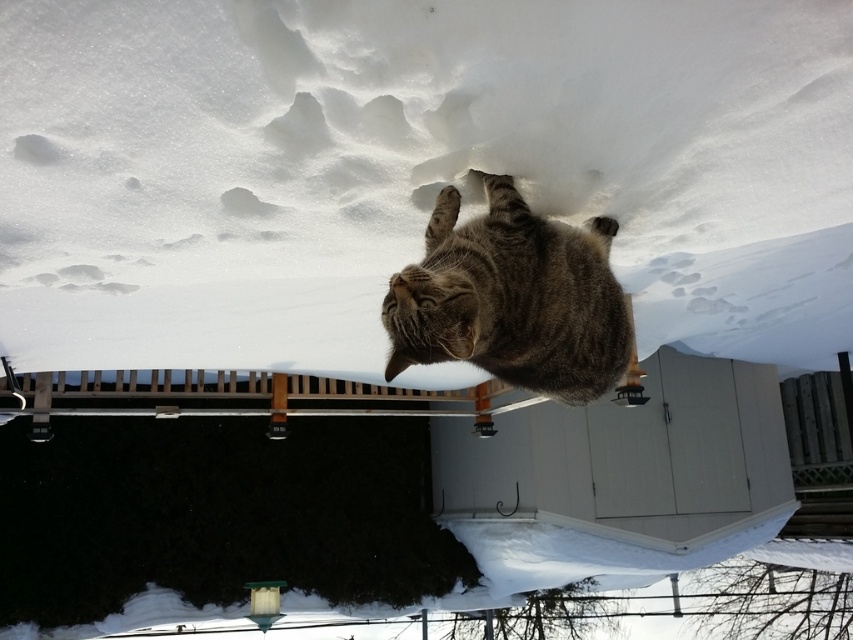
How distant is white fluffy snow at upper center from tabby fur cat at center?

white fluffy snow at upper center and tabby fur cat at center are 1.23 meters apart.

Can you confirm if white fluffy snow at upper center is thinner than tabby fur cat at center?

Incorrect, white fluffy snow at upper center's width is not less than tabby fur cat at center's.

Is point (804, 150) closer to camera compared to point (543, 257)?

That is False.

I want to click on white fluffy snow at upper center, so click(410, 168).